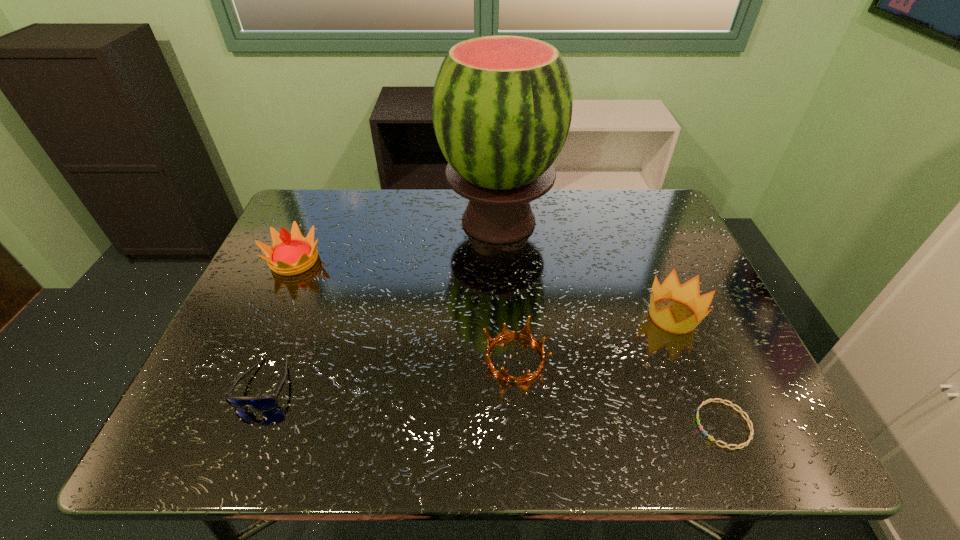
What are the coordinates of `crown that is at the right edge` in the screenshot? It's located at (688, 293).

This screenshot has width=960, height=540. In order to click on bracelet positioned at the right edge in this screenshot , I will do `click(747, 419)`.

The image size is (960, 540). In order to click on object at the near left corner in this screenshot , I will do `click(262, 403)`.

Find the location of a particular element. This screenshot has width=960, height=540. object that is at the near right corner is located at coordinates (747, 419).

Locate an element on the screen. The width and height of the screenshot is (960, 540). free point at the far edge is located at coordinates (544, 226).

This screenshot has width=960, height=540. Find the location of `vacant region at the left edge of the desktop`. vacant region at the left edge of the desktop is located at coordinates (266, 289).

This screenshot has height=540, width=960. In the image, there is a desktop. In order to click on vacant space at the right edge in this screenshot , I will do `click(694, 342)`.

Where is `free region at the far left corner`? The image size is (960, 540). free region at the far left corner is located at coordinates (334, 235).

In the image, there is a desktop. Identify the location of vacant space at the far right corner. The height and width of the screenshot is (540, 960). (640, 210).

This screenshot has height=540, width=960. I want to click on vacant area at the near right corner of the desktop, so click(710, 455).